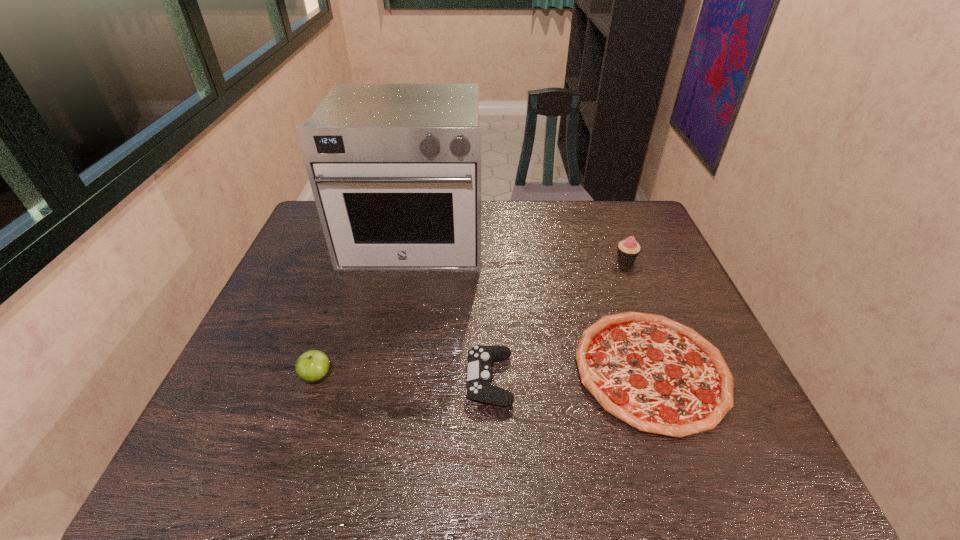
In order to click on vacant region located 0.240m on the surface of the control in this screenshot , I will do `click(363, 379)`.

What are the coordinates of `free region located on the front of the shortest object` in the screenshot? It's located at tap(690, 479).

Find the location of `object situated at the far edge`. object situated at the far edge is located at coordinates (395, 169).

Image resolution: width=960 pixels, height=540 pixels. I want to click on object at the left edge, so click(x=395, y=169).

Where is `cupcake located in the right edge section of the desktop`? cupcake located in the right edge section of the desktop is located at coordinates (628, 249).

Image resolution: width=960 pixels, height=540 pixels. Find the location of `pizza situated at the right edge`. pizza situated at the right edge is located at coordinates (659, 376).

Locate an element on the screen. This screenshot has width=960, height=540. object that is at the far left corner is located at coordinates (395, 169).

At what (x,y) coordinates should I click in order to perform the action: click on vacant space at the far edge of the desktop. Please return your answer as a coordinate pair (x, y). The width and height of the screenshot is (960, 540). Looking at the image, I should click on (573, 212).

Where is `vacant space at the near edge of the desktop`? The height and width of the screenshot is (540, 960). vacant space at the near edge of the desktop is located at coordinates point(662,452).

In the image, there is a desktop. Where is `vacant space at the left edge`? The height and width of the screenshot is (540, 960). vacant space at the left edge is located at coordinates (300, 304).